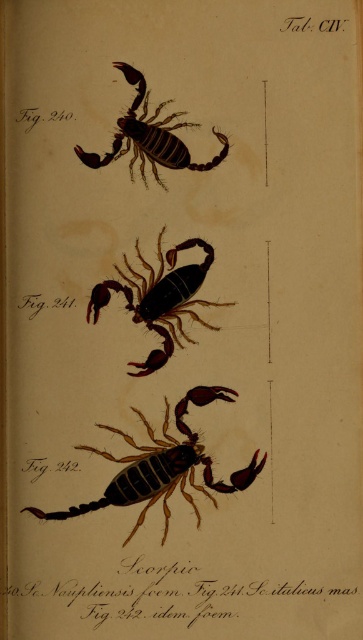
Question: Does brown textured scorpion at lower center appear over brown matte scorpion at upper center?

Choices:
 (A) yes
 (B) no

Answer: (B)

Question: Does brown textured scorpion at lower center appear over shiny brown scorpion at center?

Choices:
 (A) no
 (B) yes

Answer: (A)

Question: Which point is closer to the camera?

Choices:
 (A) brown matte scorpion at upper center
 (B) brown textured scorpion at lower center

Answer: (B)

Question: Which point appears farthest from the camera in this image?

Choices:
 (A) (196, 460)
 (B) (92, 298)

Answer: (B)

Question: Which object appears farthest from the camera in this image?

Choices:
 (A) brown textured scorpion at lower center
 (B) shiny brown scorpion at center

Answer: (B)

Question: Where is brown textured scorpion at lower center located in relation to brown matte scorpion at upper center in the image?

Choices:
 (A) below
 (B) above

Answer: (A)